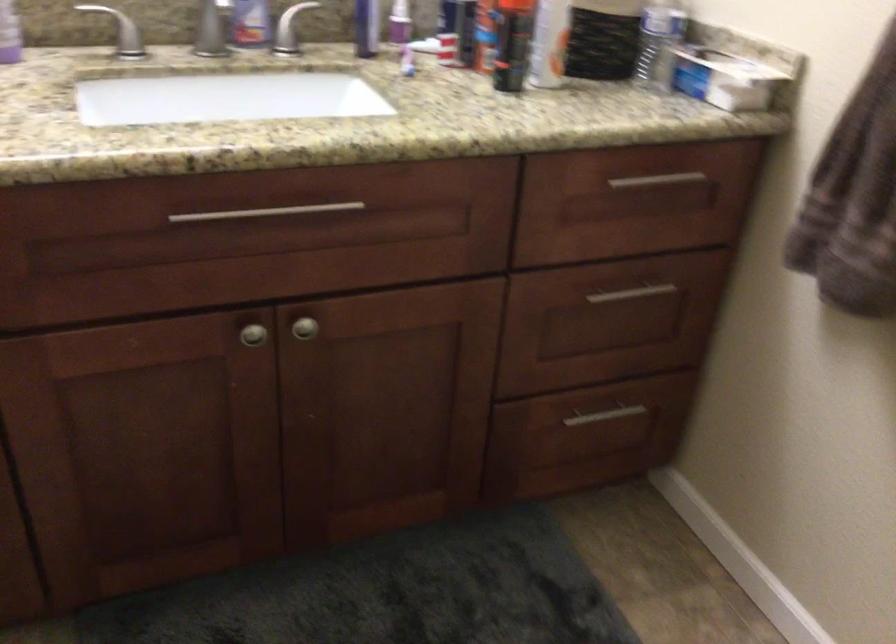
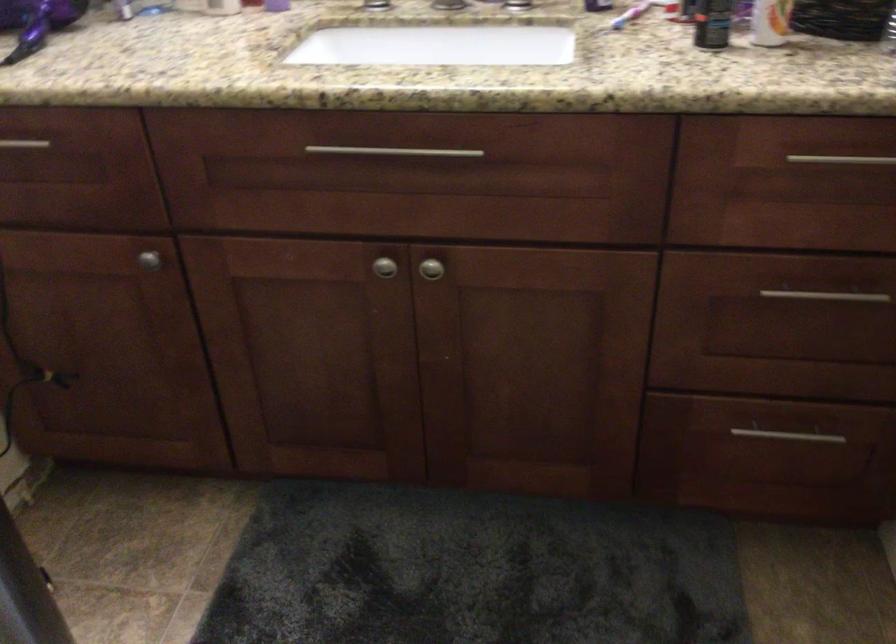
Find the pixel in the second image that matches pixel 642 182 in the first image.

(841, 158)